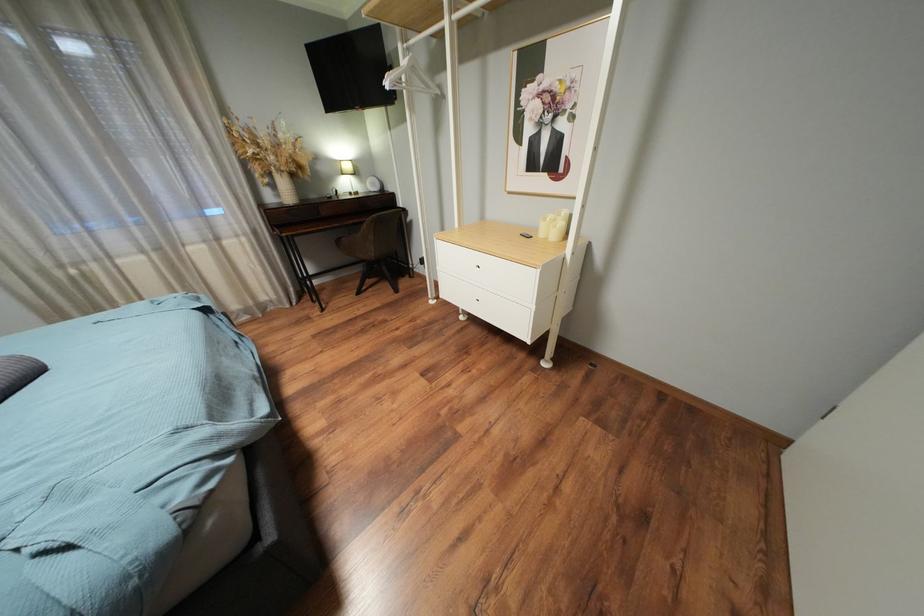
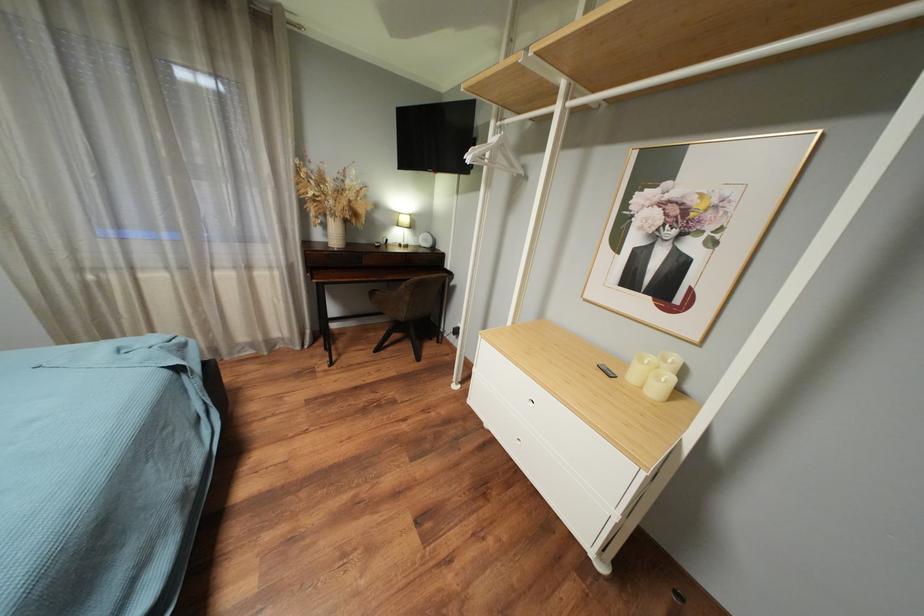
What movement of the cameraman would produce the second image?

The cameraman walked toward left, forward.